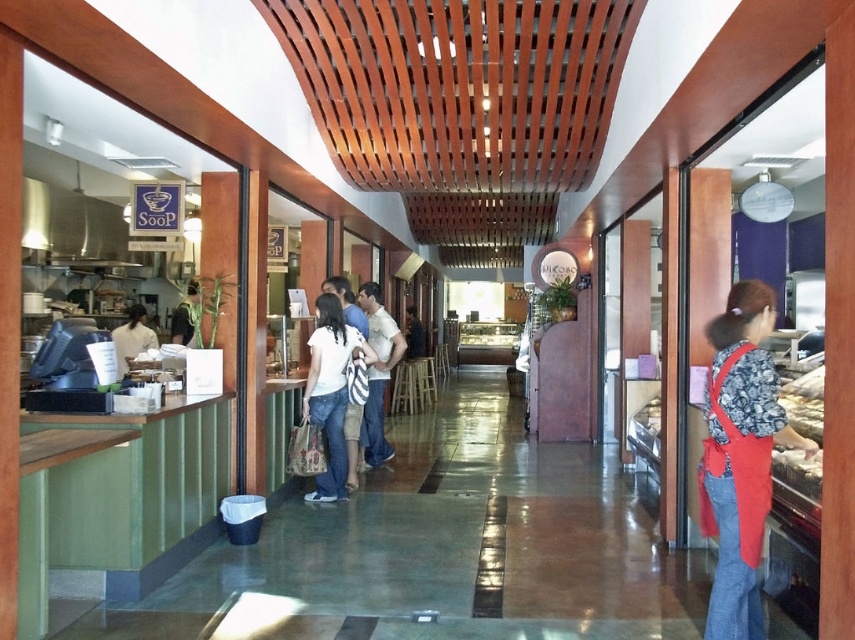
Question: Can you confirm if red fabric apron at right is positioned below white glossy bread at right?

Choices:
 (A) no
 (B) yes

Answer: (A)

Question: Which point is closer to the camera?

Choices:
 (A) red fabric apron at right
 (B) white fabric shirt at left
 (C) white cotton shirt at center
 (D) white glossy bread at right

Answer: (A)

Question: From the image, what is the correct spatial relationship of white cotton shirt at center in relation to white glossy bread at right?

Choices:
 (A) left
 (B) right

Answer: (A)

Question: Among these objects, which one is nearest to the camera?

Choices:
 (A) white cotton shirt at center
 (B) white fabric shirt at left
 (C) red fabric apron at right

Answer: (C)

Question: Can you confirm if white cotton shirt at center is smaller than white glossy bread at right?

Choices:
 (A) no
 (B) yes

Answer: (B)

Question: Considering the real-world distances, which object is farthest from the white cotton shirt at center?

Choices:
 (A) red fabric apron at right
 (B) white fabric shirt at left

Answer: (A)